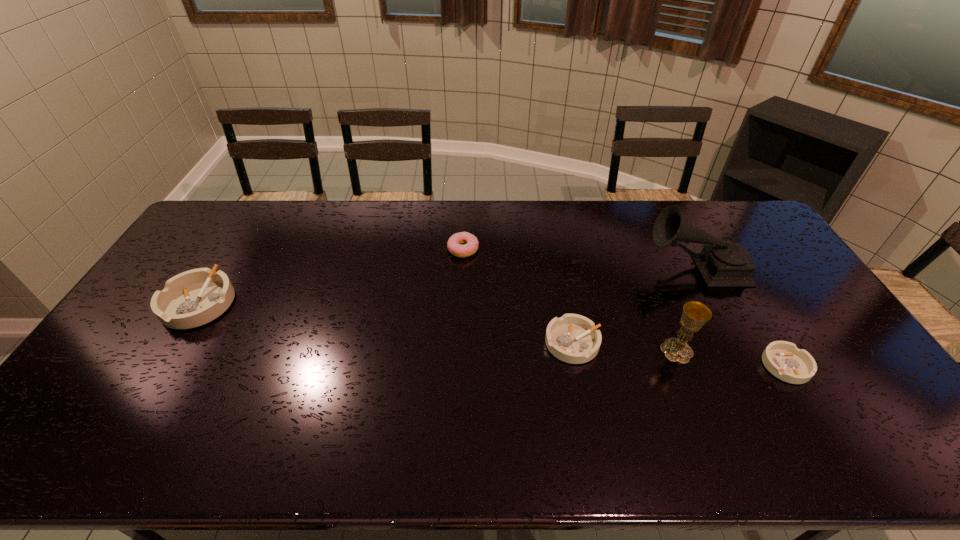
The width and height of the screenshot is (960, 540). In order to click on free space between the tallest ashtray and the fifth shortest object in this screenshot , I will do `click(438, 327)`.

At what (x,y) coordinates should I click in order to perform the action: click on free space between the chalice and the second ashtray from right to left. Please return your answer as a coordinate pair (x, y). The image size is (960, 540). Looking at the image, I should click on (625, 347).

The height and width of the screenshot is (540, 960). I want to click on free space that is in between the chalice and the doughnut, so click(570, 300).

Identify which object is located as the third nearest to the phonograph_record. Please provide its 2D coordinates. Your answer should be formatted as a tuple, i.e. [(x, y)], where the tuple contains the x and y coordinates of a point satisfying the conditions above.

[(572, 338)]

You are a GUI agent. You are given a task and a screenshot of the screen. Output one action in this format:
    pyautogui.click(x=<x>, y=<y>)
    Task: Click on the object that is the second closest to the shortest object
    The height and width of the screenshot is (540, 960).
    Given the screenshot: What is the action you would take?
    pyautogui.click(x=722, y=263)

This screenshot has height=540, width=960. Identify the location of ashtray that is the closest to the chalice. (572, 338).

Locate an element on the screen. This screenshot has width=960, height=540. ashtray that is the closest one to the second tallest object is located at coordinates (572, 338).

At what (x,y) coordinates should I click in order to perform the action: click on blank space that satisfies the following two spatial constraints: 1. on the front side of the second tallest ashtray; 2. on the left side of the shortest ashtray. Please return your answer as a coordinate pair (x, y). The width and height of the screenshot is (960, 540). Looking at the image, I should click on (577, 366).

I want to click on vacant space that satisfies the following two spatial constraints: 1. on the front side of the second shortest ashtray; 2. on the right side of the third tallest object, so click(x=175, y=343).